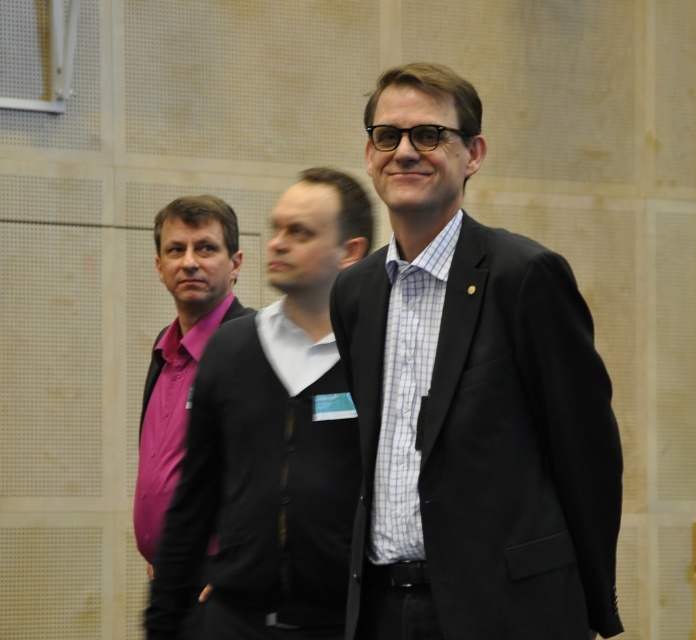
Question: Which object is closer to the camera taking this photo?

Choices:
 (A) matte black suit at center
 (B) pink fabric shirt at left

Answer: (A)

Question: Where is matte black suit at center located in relation to pink fabric shirt at left in the image?

Choices:
 (A) left
 (B) right

Answer: (B)

Question: Does matte black suit at center have a greater width compared to pink fabric shirt at left?

Choices:
 (A) no
 (B) yes

Answer: (B)

Question: Is matte black suit at center to the right of pink fabric shirt at left from the viewer's perspective?

Choices:
 (A) no
 (B) yes

Answer: (B)